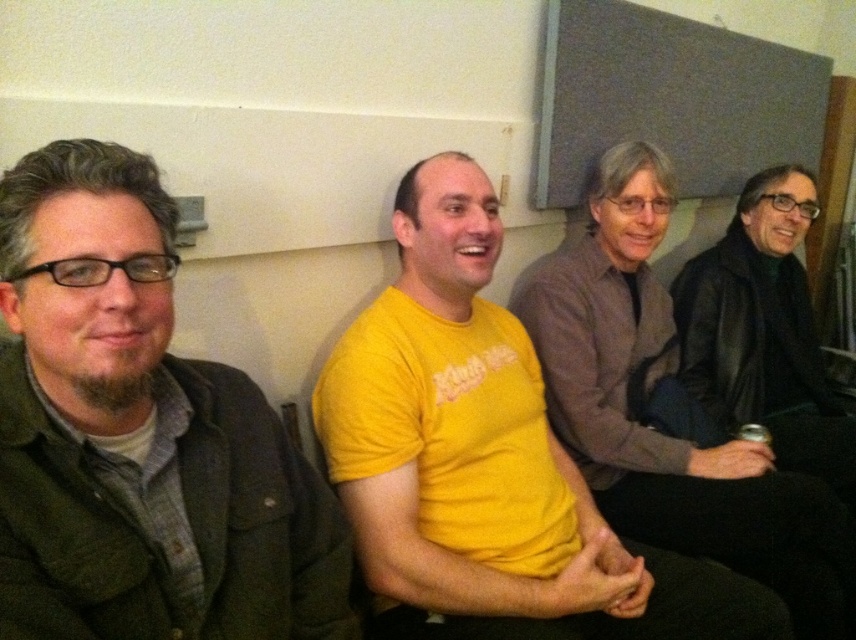
Is yellow t-shirt at center thinner than black leather jacket at right?

In fact, yellow t-shirt at center might be wider than black leather jacket at right.

Which of these two, yellow t-shirt at center or black leather jacket at right, stands taller?

With more height is yellow t-shirt at center.

Where is `yellow t-shirt at center`? The height and width of the screenshot is (640, 856). yellow t-shirt at center is located at coordinates (652, 419).

Who is higher up, matte black jacket at left or yellow t-shirt at center?

matte black jacket at left

Identify the location of matte black jacket at left. (140, 436).

Between matte black jacket at left and black leather jacket at right, which one appears on the left side from the viewer's perspective?

From the viewer's perspective, matte black jacket at left appears more on the left side.

Based on the photo, which of these two, matte black jacket at left or black leather jacket at right, stands taller?

Standing taller between the two is black leather jacket at right.

Locate an element on the screen. The image size is (856, 640). matte black jacket at left is located at coordinates (140, 436).

Identify the location of matte black jacket at left. The image size is (856, 640). (140, 436).